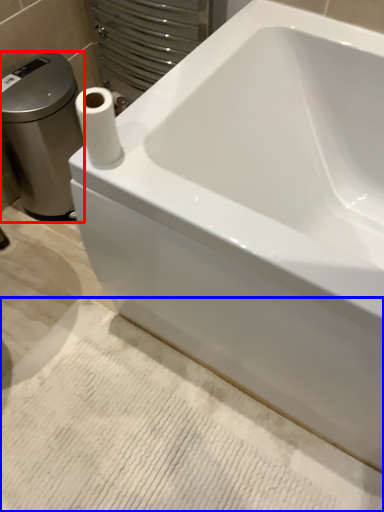
Question: Which of the following is the farthest to the observer, porcelain (highlighted by a red box) or bath mat (highlighted by a blue box)?

Choices:
 (A) porcelain
 (B) bath mat

Answer: (A)